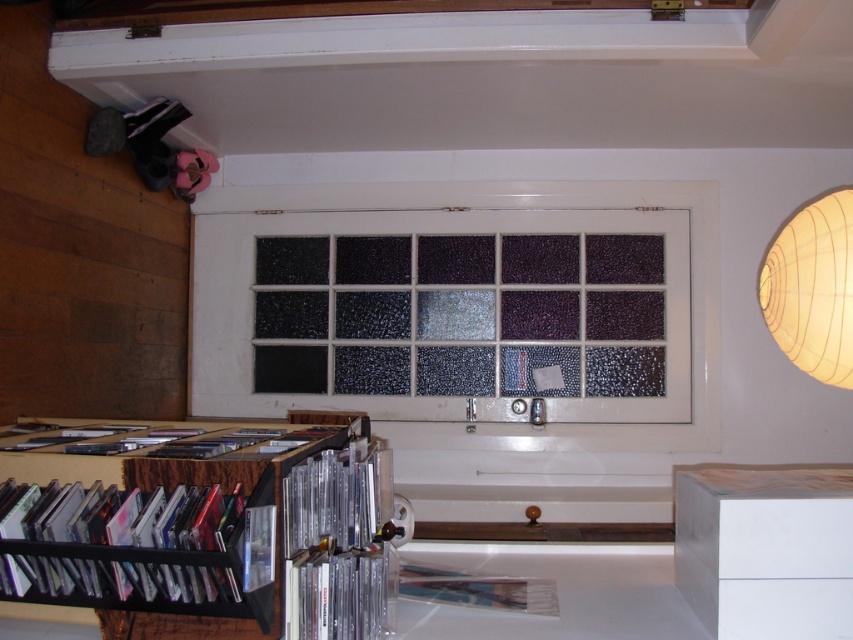
You are organizing CDs on a shelf and notice two CD cases at the lower left of the window. Which CD case is closer to you, the clear plastic cd cases at lower left or the black plastic cd case at lower left?

The clear plastic cd cases at lower left is closer to you because it is further to the viewer than the black plastic cd case at lower left.